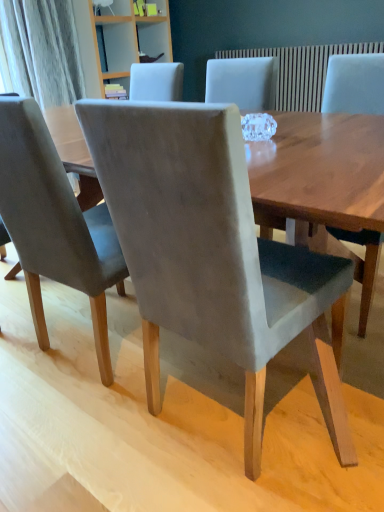
The image size is (384, 512). I want to click on velvet gray chair at center, the first chair from the right, so click(354, 84).

Find the location of a particular element. This screenshot has height=512, width=384. suede gray chair at center, acting as the third chair starting from the right is located at coordinates (54, 223).

Can we say suede gray chair at center, the second chair in the left-to-right sequence, lies outside suede gray chair at center, the 1th chair viewed from the left?

That's correct, suede gray chair at center, the second chair in the left-to-right sequence, is outside of suede gray chair at center, the 1th chair viewed from the left.

Which is in front, point (192, 212) or point (104, 369)?

The point (192, 212) is in front.

Considering the positions of objects suede gray chair at center, arranged as the 2th chair when viewed from the right, and suede gray chair at center, the 1th chair viewed from the left, in the image provided, who is in front, suede gray chair at center, arranged as the 2th chair when viewed from the right, or suede gray chair at center, the 1th chair viewed from the left,?

suede gray chair at center, arranged as the 2th chair when viewed from the right, is more forward.

What's the angular difference between suede gray chair at center, arranged as the 2th chair when viewed from the right, and suede gray chair at center, acting as the third chair starting from the right,'s facing directions?

The angular difference between suede gray chair at center, arranged as the 2th chair when viewed from the right, and suede gray chair at center, acting as the third chair starting from the right, is 1.92e-05 degrees.

Is suede gray chair at center, the second chair in the left-to-right sequence, completely or partially outside of velvet gray chair at center, which is the 3th chair in left-to-right order?

Yes.

From a real-world perspective, count 1st chairs upward from the suede gray chair at center, the second chair in the left-to-right sequence, and point to it. Please provide its 2D coordinates.

[(354, 84)]

From the image's perspective, between suede gray chair at center, the second chair in the left-to-right sequence, and velvet gray chair at center, which is the 3th chair in left-to-right order, who is located below?

From the image's view, suede gray chair at center, the second chair in the left-to-right sequence, is below.

Can you confirm if suede gray chair at center, arranged as the 2th chair when viewed from the right, is smaller than velvet gray chair at center, the first chair from the right?

Result: Actually, suede gray chair at center, arranged as the 2th chair when viewed from the right, might be larger than velvet gray chair at center, the first chair from the right.

Which of these two, suede gray chair at center, the 1th chair viewed from the left, or suede gray chair at center, arranged as the 2th chair when viewed from the right, is smaller?

suede gray chair at center, the 1th chair viewed from the left.

From the image's perspective, which object appears higher, suede gray chair at center, the 1th chair viewed from the left, or suede gray chair at center, the second chair in the left-to-right sequence?

suede gray chair at center, the 1th chair viewed from the left, is shown above in the image.

Starting from the suede gray chair at center, acting as the third chair starting from the right, which chair is the 1st one to the right? Please provide its 2D coordinates.

[(211, 253)]

Could you measure the distance between suede gray chair at center, the 1th chair viewed from the left, and suede gray chair at center, arranged as the 2th chair when viewed from the right?

suede gray chair at center, the 1th chair viewed from the left, and suede gray chair at center, arranged as the 2th chair when viewed from the right, are 16.10 inches apart.

From the image's perspective, is suede gray chair at center, acting as the third chair starting from the right, located above velvet gray chair at center, which is the 3th chair in left-to-right order?

No, from the image's perspective, suede gray chair at center, acting as the third chair starting from the right, is not over velvet gray chair at center, which is the 3th chair in left-to-right order.

Can you tell me how much suede gray chair at center, the 1th chair viewed from the left, and velvet gray chair at center, the first chair from the right, differ in facing direction?

The facing directions of suede gray chair at center, the 1th chair viewed from the left, and velvet gray chair at center, the first chair from the right, are 180 degrees apart.

Considering the relative sizes of suede gray chair at center, the 1th chair viewed from the left, and velvet gray chair at center, which is the 3th chair in left-to-right order, in the image provided, is suede gray chair at center, the 1th chair viewed from the left, taller than velvet gray chair at center, which is the 3th chair in left-to-right order,?

Yes.

Is point (377, 265) more distant than point (150, 317)?

That is True.

From a real-world perspective, which object stands above the other?

velvet gray chair at center, the first chair from the right.

This screenshot has width=384, height=512. Identify the location of chair on the right of suede gray chair at center, the second chair in the left-to-right sequence. (354, 84).

Is velvet gray chair at center, which is the 3th chair in left-to-right order, turned away from suede gray chair at center, arranged as the 2th chair when viewed from the right?

No, velvet gray chair at center, which is the 3th chair in left-to-right order, is not facing away from suede gray chair at center, arranged as the 2th chair when viewed from the right.

Considering the relative positions of velvet gray chair at center, the first chair from the right, and suede gray chair at center, the 1th chair viewed from the left, in the image provided, is velvet gray chair at center, the first chair from the right, to the right of suede gray chair at center, the 1th chair viewed from the left, from the viewer's perspective?

Correct, you'll find velvet gray chair at center, the first chair from the right, to the right of suede gray chair at center, the 1th chair viewed from the left.

From a real-world perspective, is velvet gray chair at center, the first chair from the right, under suede gray chair at center, the 1th chair viewed from the left?

Correct, in the physical world, velvet gray chair at center, the first chair from the right, is lower than suede gray chair at center, the 1th chair viewed from the left.

Between point (364, 67) and point (21, 113), which one is positioned behind?

Point (364, 67)

Considering the relative sizes of velvet gray chair at center, which is the 3th chair in left-to-right order, and suede gray chair at center, acting as the third chair starting from the right, in the image provided, is velvet gray chair at center, which is the 3th chair in left-to-right order, smaller than suede gray chair at center, acting as the third chair starting from the right,?

Correct, velvet gray chair at center, which is the 3th chair in left-to-right order, occupies less space than suede gray chair at center, acting as the third chair starting from the right.

Identify the location of the 1st chair counting from the right side of the suede gray chair at center, acting as the third chair starting from the right. (211, 253).

Where is `chair that is the 1st one above the suede gray chair at center, the second chair in the left-to-right sequence (from a real-world perspective)`? This screenshot has width=384, height=512. chair that is the 1st one above the suede gray chair at center, the second chair in the left-to-right sequence (from a real-world perspective) is located at coordinates (354, 84).

Estimate the real-world distances between objects in this image. Which object is further from velvet gray chair at center, the first chair from the right, suede gray chair at center, the 1th chair viewed from the left, or suede gray chair at center, the second chair in the left-to-right sequence?

suede gray chair at center, the 1th chair viewed from the left, lies further to velvet gray chair at center, the first chair from the right, than the other object.

Which object lies nearer to the anchor point suede gray chair at center, arranged as the 2th chair when viewed from the right, velvet gray chair at center, which is the 3th chair in left-to-right order, or suede gray chair at center, acting as the third chair starting from the right?

suede gray chair at center, acting as the third chair starting from the right, is positioned closer to the anchor suede gray chair at center, arranged as the 2th chair when viewed from the right.

Estimate the real-world distances between objects in this image. Which object is closer to velvet gray chair at center, the first chair from the right, suede gray chair at center, arranged as the 2th chair when viewed from the right, or suede gray chair at center, the 1th chair viewed from the left?

The object closer to velvet gray chair at center, the first chair from the right, is suede gray chair at center, arranged as the 2th chair when viewed from the right.

Which object lies nearer to the anchor point suede gray chair at center, arranged as the 2th chair when viewed from the right, suede gray chair at center, acting as the third chair starting from the right, or velvet gray chair at center, which is the 3th chair in left-to-right order?

Among the two, suede gray chair at center, acting as the third chair starting from the right, is located nearer to suede gray chair at center, arranged as the 2th chair when viewed from the right.

Considering their positions, is suede gray chair at center, arranged as the 2th chair when viewed from the right, positioned further to suede gray chair at center, acting as the third chair starting from the right, than velvet gray chair at center, the first chair from the right?

The object further to suede gray chair at center, acting as the third chair starting from the right, is velvet gray chair at center, the first chair from the right.

Estimate the real-world distances between objects in this image. Which object is further from suede gray chair at center, the 1th chair viewed from the left, velvet gray chair at center, which is the 3th chair in left-to-right order, or suede gray chair at center, arranged as the 2th chair when viewed from the right?

velvet gray chair at center, which is the 3th chair in left-to-right order, is further to suede gray chair at center, the 1th chair viewed from the left.

Identify the location of chair between suede gray chair at center, the 1th chair viewed from the left, and velvet gray chair at center, the first chair from the right, from left to right. Image resolution: width=384 pixels, height=512 pixels. (211, 253).